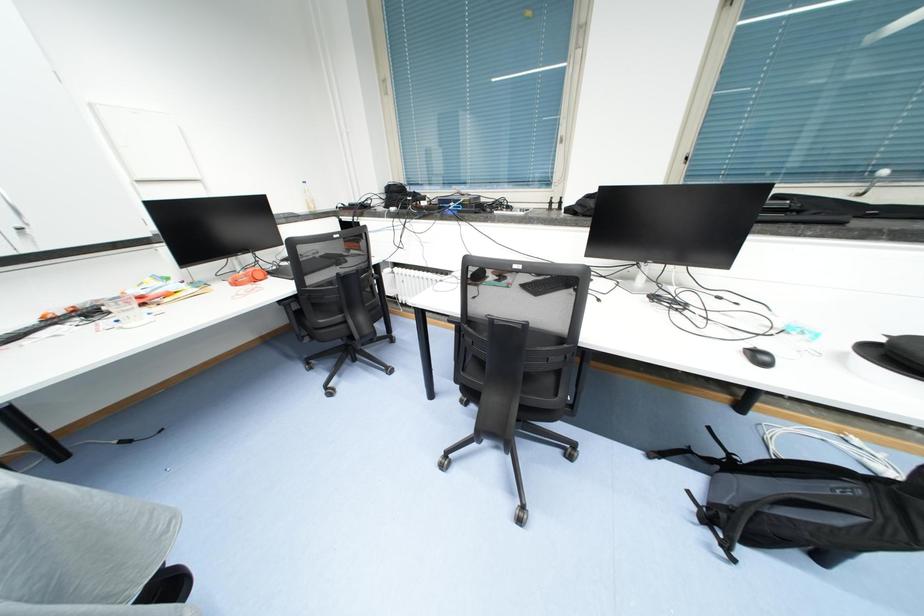
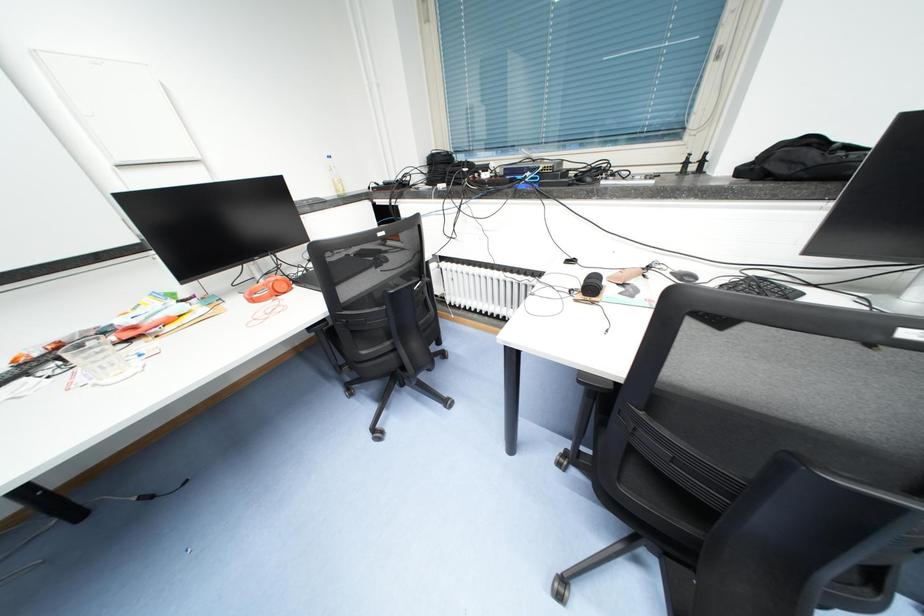
Question: The camera is either moving clockwise (left) or counter-clockwise (right) around the object. The first image is from the beginning of the video and the second image is from the end. Is the camera moving left or right when shooting the video?

Choices:
 (A) Left
 (B) Right

Answer: (B)